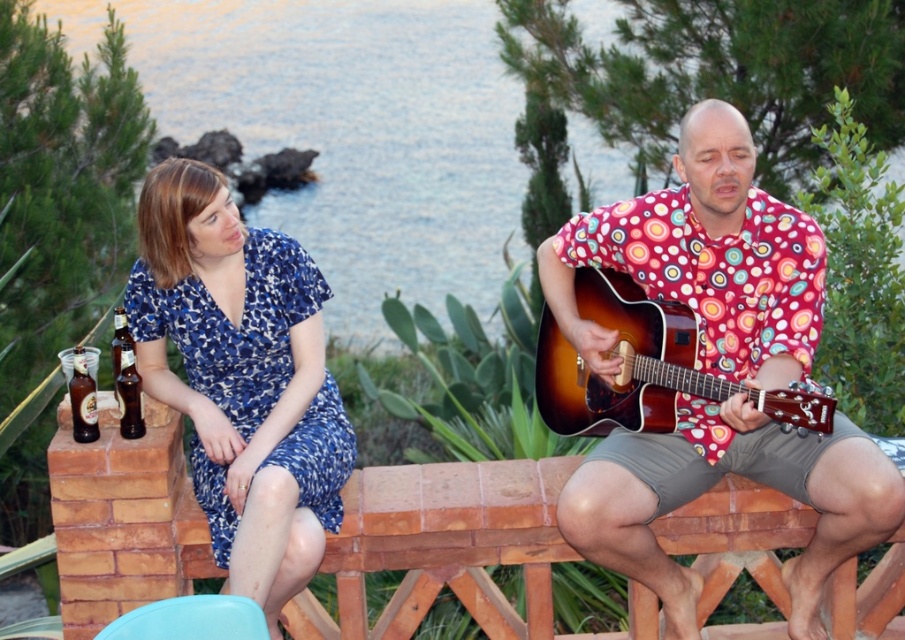
Which is above, blue printed dress at left or translucent glass bottle at left?

blue printed dress at left is higher up.

Is blue printed dress at left to the right of translucent glass bottle at left from the viewer's perspective?

Yes, blue printed dress at left is to the right of translucent glass bottle at left.

Between point (313, 413) and point (84, 412), which one is positioned in front?

Point (84, 412) is more forward.

The height and width of the screenshot is (640, 905). In order to click on blue printed dress at left in this screenshot , I will do `click(241, 378)`.

Does matte red shirt at center have a lesser height compared to satin wood guitar at right?

Incorrect, matte red shirt at center's height does not fall short of satin wood guitar at right's.

Can you confirm if matte red shirt at center is wider than satin wood guitar at right?

Yes.

Measure the distance between point (599, 324) and camera.

Point (599, 324) is 14.12 feet from camera.

Find the location of a particular element. Image resolution: width=905 pixels, height=640 pixels. matte red shirt at center is located at coordinates (703, 259).

Between matte red shirt at center and translucent glass bottle at left, which one has less height?

With less height is translucent glass bottle at left.

Which is behind, point (731, 106) or point (84, 422)?

The point (731, 106) is more distant.

Find the location of a particular element. The height and width of the screenshot is (640, 905). matte red shirt at center is located at coordinates (703, 259).